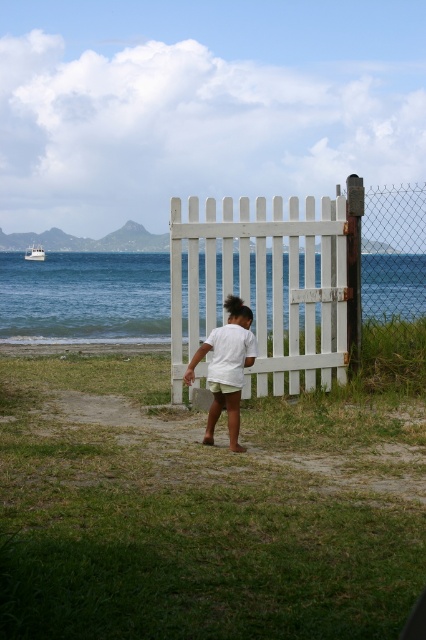
Is green grass at center above white glossy boat at upper left?

No.

Which is more to the right, green grass at center or white glossy boat at upper left?

green grass at center is more to the right.

This screenshot has height=640, width=426. Identify the location of green grass at center. (193, 515).

Between white wooden gate at center and blue water at center, which one is positioned lower?

Positioned lower is white wooden gate at center.

Who is positioned more to the left, white wooden gate at center or blue water at center?

blue water at center

Who is more distant from viewer, (x=206, y=282) or (x=160, y=272)?

Positioned behind is point (x=160, y=272).

I want to click on white wooden gate at center, so click(299, 276).

Can you confirm if blue water at center is positioned below white glossy boat at upper left?

Yes.

What do you see at coordinates (85, 296) in the screenshot?
I see `blue water at center` at bounding box center [85, 296].

Is point (155, 317) farther from camera compared to point (31, 257)?

No, (155, 317) is in front of (31, 257).

Identify the location of blue water at center. (85, 296).